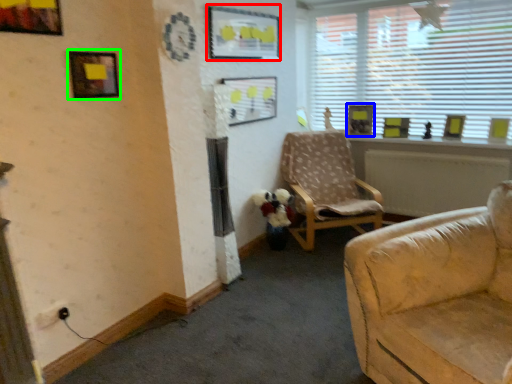
Question: Which object is positioned closest to picture frame (highlighted by a red box)? Select from picture frame (highlighted by a blue box) and picture frame (highlighted by a green box).

Choices:
 (A) picture frame
 (B) picture frame

Answer: (B)